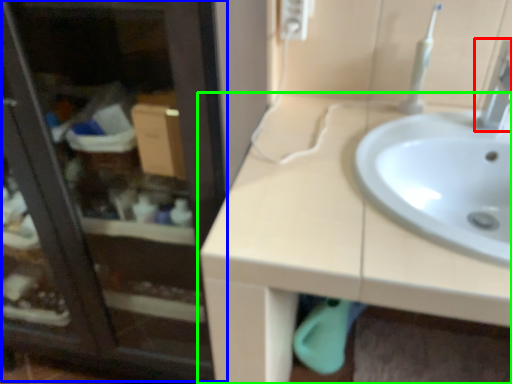
Question: Which object is positioned farthest from tap (highlighted by a red box)? Select from screen door (highlighted by a blue box) and countertop (highlighted by a green box).

Choices:
 (A) screen door
 (B) countertop

Answer: (A)